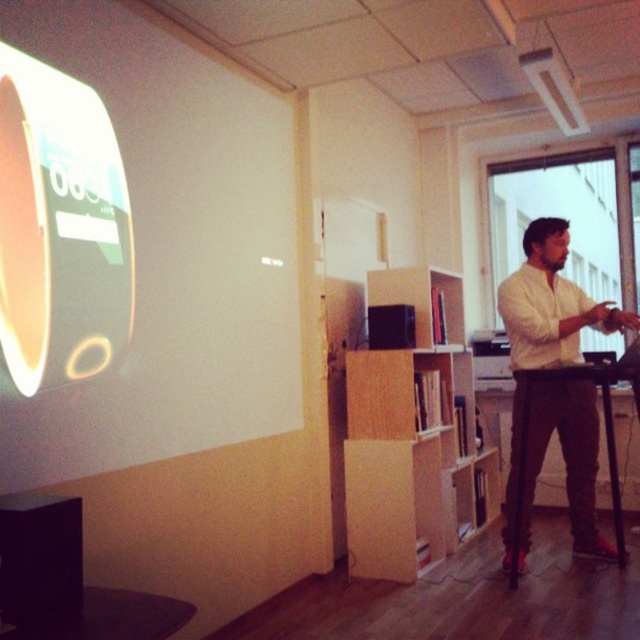
Question: Is white matte projection screen at upper left positioned in front of wooden bookshelf at center?

Choices:
 (A) yes
 (B) no

Answer: (A)

Question: Can you confirm if wooden bookshelf at center is bigger than white cotton shirt at right?

Choices:
 (A) no
 (B) yes

Answer: (B)

Question: Which is nearer to the wooden bookshelf at center?

Choices:
 (A) white cotton shirt at right
 (B) white matte projection screen at upper left

Answer: (A)

Question: Which of these objects is positioned farthest from the wooden bookshelf at center?

Choices:
 (A) white matte projection screen at upper left
 (B) white cotton shirt at right

Answer: (A)

Question: Observing the image, what is the correct spatial positioning of white matte projection screen at upper left in reference to white cotton shirt at right?

Choices:
 (A) above
 (B) below

Answer: (A)

Question: Estimate the real-world distances between objects in this image. Which object is farther from the white matte projection screen at upper left?

Choices:
 (A) wooden bookshelf at center
 (B) white cotton shirt at right

Answer: (B)